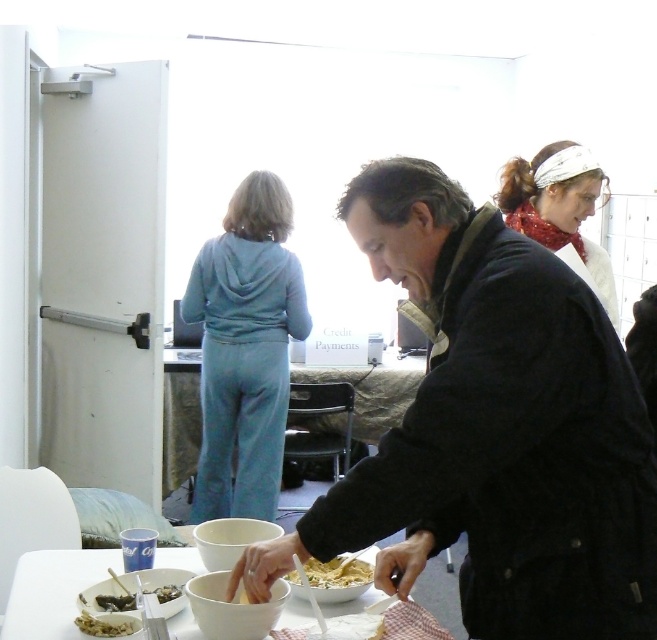
Question: Among these objects, which one is farthest from the camera?

Choices:
 (A) white matte table at center
 (B) white matte pasta at center

Answer: (B)

Question: From the image, what is the correct spatial relationship of crumbly brown bread at lower left in relation to shiny metallic spoon at lower left?

Choices:
 (A) left
 (B) right

Answer: (A)

Question: Is crumbly brown bread at lower left bigger than shiny metallic spoon at lower left?

Choices:
 (A) yes
 (B) no

Answer: (B)

Question: Which of these objects is positioned closest to the white matte pasta at center?

Choices:
 (A) light blue fabric pants at center
 (B) shiny metallic spoon at lower left

Answer: (B)

Question: Estimate the real-world distances between objects in this image. Which object is closer to the light blue fabric pants at center?

Choices:
 (A) white matte table at center
 (B) crumbly brown bread at lower left
 (C) shiny metallic spoon at lower left
 (D) dark blue jacket at center

Answer: (A)

Question: Does white matte pasta at center have a greater width compared to shiny metallic spoon at lower left?

Choices:
 (A) no
 (B) yes

Answer: (B)